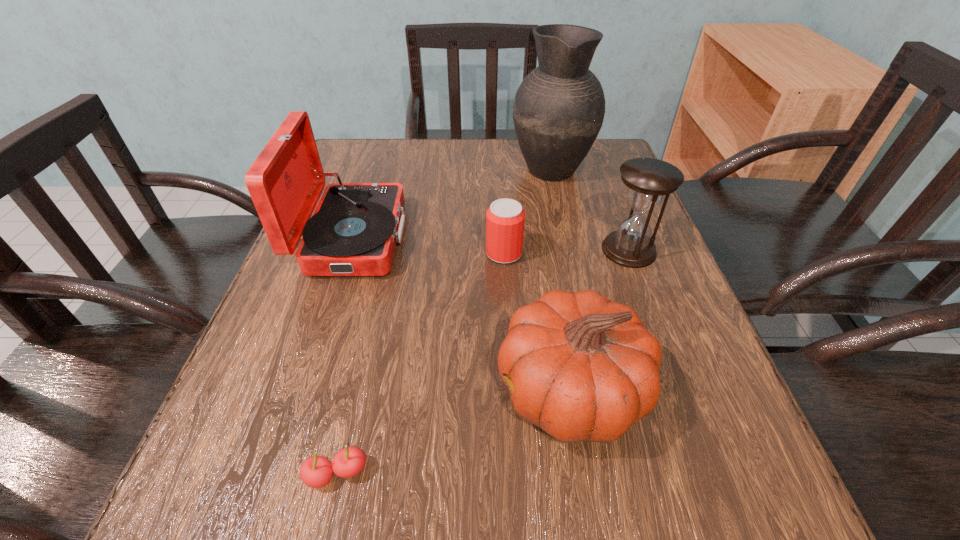
Where is `free spot between the cherry and the pumpkin`? Image resolution: width=960 pixels, height=540 pixels. free spot between the cherry and the pumpkin is located at coordinates (453, 432).

The image size is (960, 540). I want to click on empty space between the second shortest object and the cherry, so click(420, 363).

What are the coordinates of `unoccupied position between the cherry and the pumpkin` in the screenshot? It's located at (x=453, y=432).

Find the location of a particular element. vacant area that lies between the farthest object and the cherry is located at coordinates (444, 321).

Locate an element on the screen. vacant point located between the hourglass and the second shortest object is located at coordinates (566, 252).

This screenshot has width=960, height=540. I want to click on vacant space that is in between the shortest object and the fifth shortest object, so click(x=345, y=356).

The height and width of the screenshot is (540, 960). Identify the location of the second closest object relative to the fifth shortest object. (582, 368).

Choose which object is the fourth nearest neighbor to the hourglass. Please provide its 2D coordinates. Your answer should be formatted as a tuple, i.e. [(x, y)], where the tuple contains the x and y coordinates of a point satisfying the conditions above.

[(354, 229)]

This screenshot has width=960, height=540. What are the coordinates of `vacant space that satisfies the following two spatial constraints: 1. on the back side of the second shortest object; 2. on the front-facing side of the phonograph_record` in the screenshot? It's located at (503, 238).

Where is `vacant space that satisfies the following two spatial constraints: 1. on the front side of the hourglass; 2. on the face of the pumpkin`? The image size is (960, 540). vacant space that satisfies the following two spatial constraints: 1. on the front side of the hourglass; 2. on the face of the pumpkin is located at coordinates (682, 390).